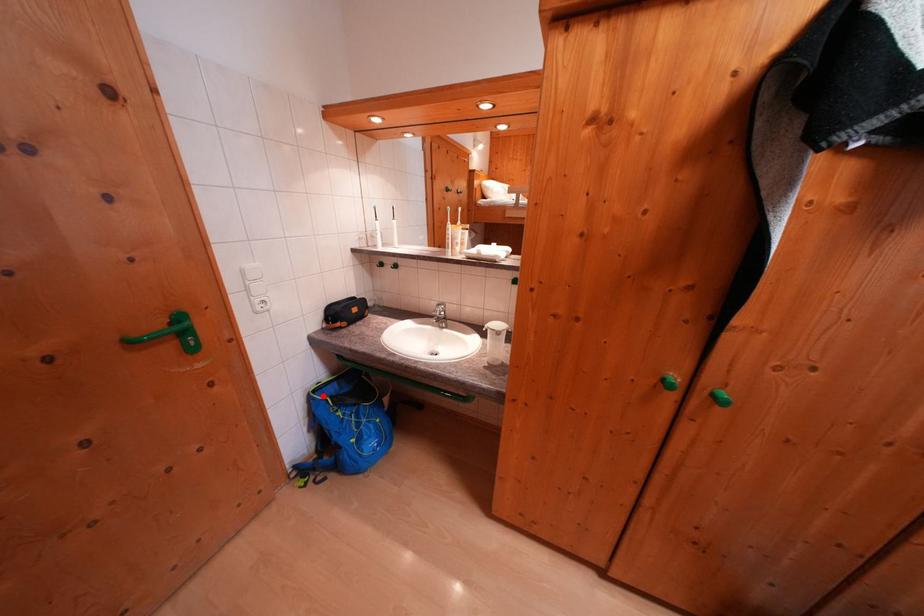
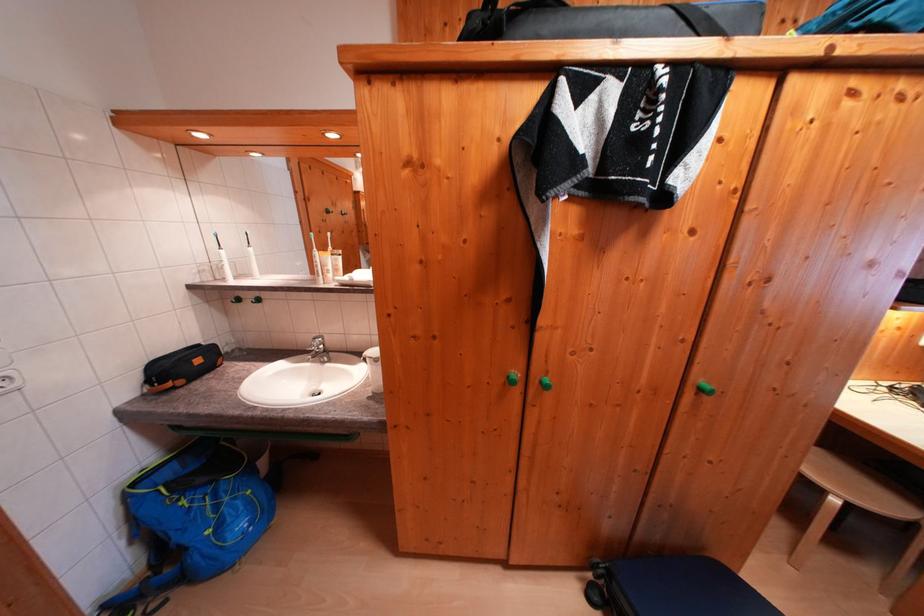
In the second image, find the point that corresponds to the highlighted location in the first image.

(142, 488)